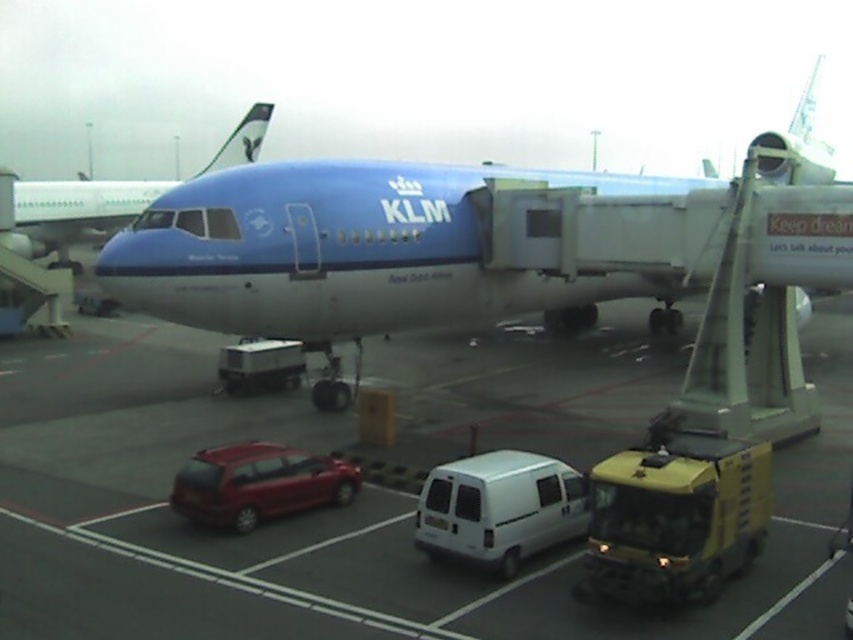
Can you confirm if smooth asphalt tarmac at center is wider than yellow matte van at lower right?

Indeed, smooth asphalt tarmac at center has a greater width compared to yellow matte van at lower right.

Which is more to the left, smooth asphalt tarmac at center or yellow matte van at lower right?

smooth asphalt tarmac at center is more to the left.

What do you see at coordinates (364, 492) in the screenshot? Image resolution: width=853 pixels, height=640 pixels. I see `smooth asphalt tarmac at center` at bounding box center [364, 492].

The image size is (853, 640). I want to click on smooth asphalt tarmac at center, so click(x=364, y=492).

Which is in front, point (665, 365) or point (70, 189)?

Point (665, 365) is in front.

Is smooth asphalt tarmac at center below matte blue airplane at upper center?

Yes.

Is point (86, 342) farther from camera compared to point (30, 186)?

No.

Locate an element on the screen. smooth asphalt tarmac at center is located at coordinates (364, 492).

Measure the distance between yellow matte van at lower right and shiny red hatchback at lower left.

The distance of yellow matte van at lower right from shiny red hatchback at lower left is 21.07 feet.

Is yellow matte van at lower right above shiny red hatchback at lower left?

Actually, yellow matte van at lower right is below shiny red hatchback at lower left.

Between point (619, 541) and point (262, 515), which one is positioned in front?

Point (619, 541) is more forward.

Identify the location of yellow matte van at lower right. (675, 518).